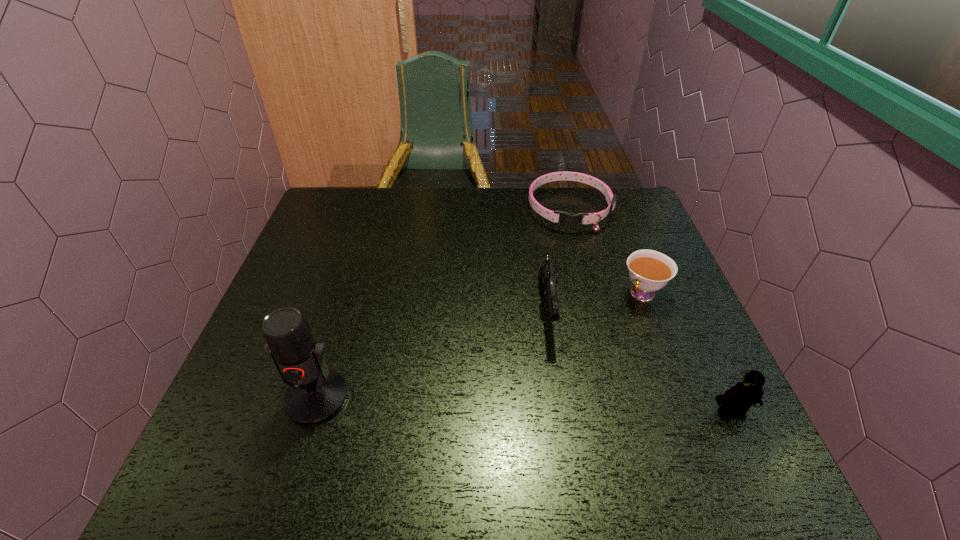
The height and width of the screenshot is (540, 960). Find the location of `free space between the Lego and the gun`. free space between the Lego and the gun is located at coordinates coord(638,361).

Select which object is the second closest to the tallest object. Please provide its 2D coordinates. Your answer should be formatted as a tuple, i.e. [(x, y)], where the tuple contains the x and y coordinates of a point satisfying the conditions above.

[(568, 219)]

Select which object is the fourth closest to the gun. Please provide its 2D coordinates. Your answer should be formatted as a tuple, i.e. [(x, y)], where the tuple contains the x and y coordinates of a point satisfying the conditions above.

[(316, 394)]

Where is `vacant space that satisfies the following two spatial constraints: 1. on the front side of the second shortest object; 2. on the right side of the dog collar`? vacant space that satisfies the following two spatial constraints: 1. on the front side of the second shortest object; 2. on the right side of the dog collar is located at coordinates (591, 294).